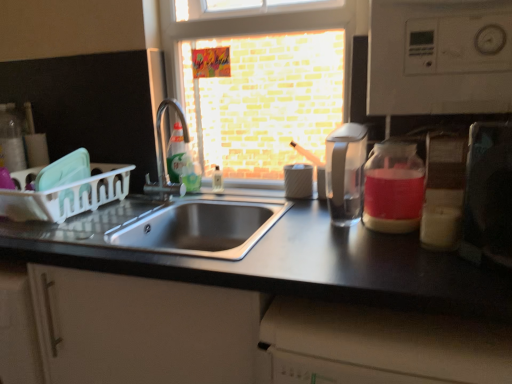
Question: Considering the relative sizes of white plastic dish rack at left and pink translucent glass jar at right in the image provided, is white plastic dish rack at left thinner than pink translucent glass jar at right?

Choices:
 (A) no
 (B) yes

Answer: (A)

Question: Considering the relative sizes of white plastic dish rack at left and pink translucent glass jar at right in the image provided, is white plastic dish rack at left shorter than pink translucent glass jar at right?

Choices:
 (A) yes
 (B) no

Answer: (A)

Question: Would you say white plastic dish rack at left contains pink translucent glass jar at right?

Choices:
 (A) no
 (B) yes

Answer: (A)

Question: Is white plastic dish rack at left located outside pink translucent glass jar at right?

Choices:
 (A) yes
 (B) no

Answer: (A)

Question: From a real-world perspective, is white plastic dish rack at left located beneath pink translucent glass jar at right?

Choices:
 (A) no
 (B) yes

Answer: (B)

Question: Does point (240, 61) appear closer or farther from the camera than point (375, 163)?

Choices:
 (A) closer
 (B) farther

Answer: (B)

Question: Is brick wall at center taller or shorter than pink translucent glass jar at right?

Choices:
 (A) short
 (B) tall

Answer: (B)

Question: Which is correct: brick wall at center is inside pink translucent glass jar at right, or outside of it?

Choices:
 (A) inside
 (B) outside

Answer: (B)

Question: From the image's perspective, relative to pink translucent glass jar at right, is brick wall at center above or below?

Choices:
 (A) above
 (B) below

Answer: (A)

Question: Considering the positions of pink translucent glass jar at right and metallic silver toaster at right in the image, is pink translucent glass jar at right taller or shorter than metallic silver toaster at right?

Choices:
 (A) tall
 (B) short

Answer: (B)

Question: From a real-world perspective, is pink translucent glass jar at right physically located above or below metallic silver toaster at right?

Choices:
 (A) below
 (B) above

Answer: (A)

Question: From the image's perspective, relative to metallic silver toaster at right, is pink translucent glass jar at right above or below?

Choices:
 (A) below
 (B) above

Answer: (B)

Question: Is pink translucent glass jar at right inside the boundaries of metallic silver toaster at right, or outside?

Choices:
 (A) outside
 (B) inside

Answer: (A)

Question: From the image's perspective, is brick wall at center located above or below metallic silver toaster at right?

Choices:
 (A) below
 (B) above

Answer: (B)

Question: Considering the positions of point tap(208, 110) and point tap(465, 182), is point tap(208, 110) closer or farther from the camera than point tap(465, 182)?

Choices:
 (A) closer
 (B) farther

Answer: (B)